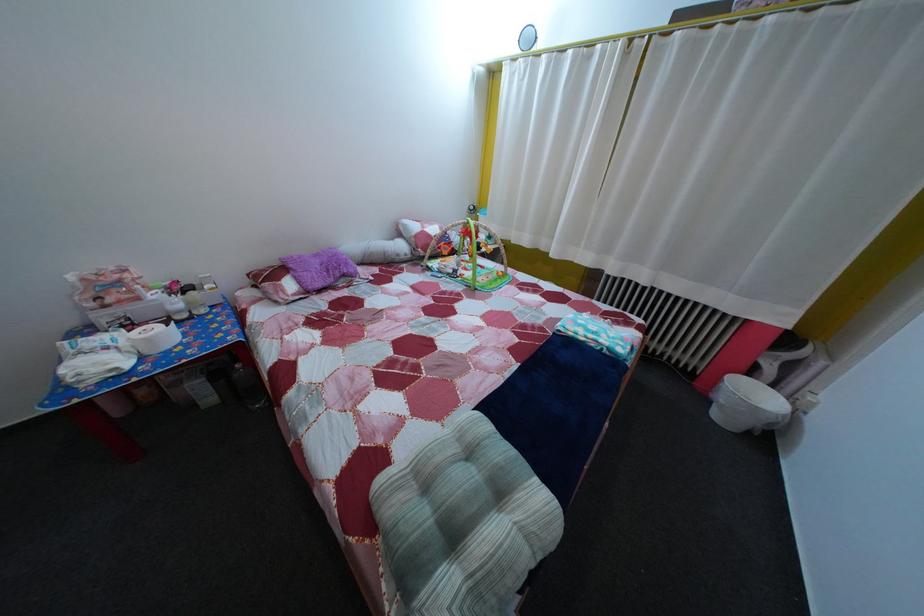
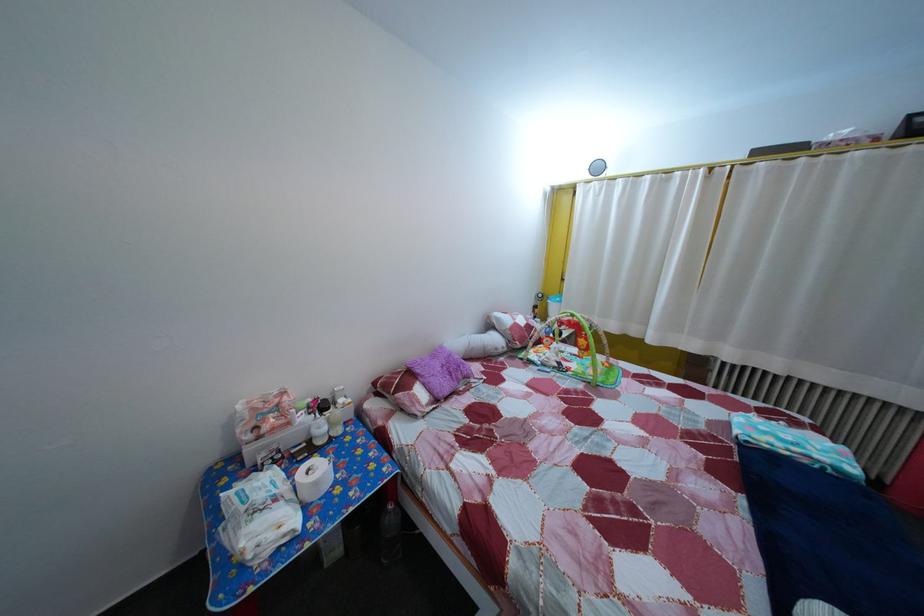
In the second image, find the point that corresponds to pixel 459 278 in the first image.

(565, 371)